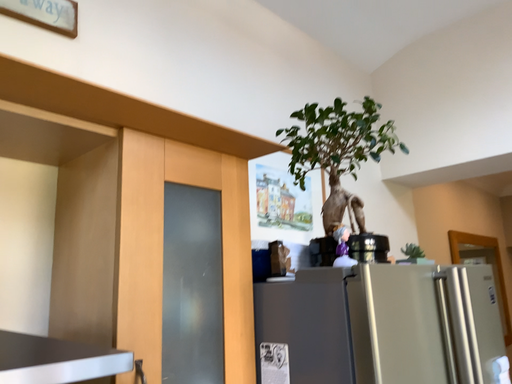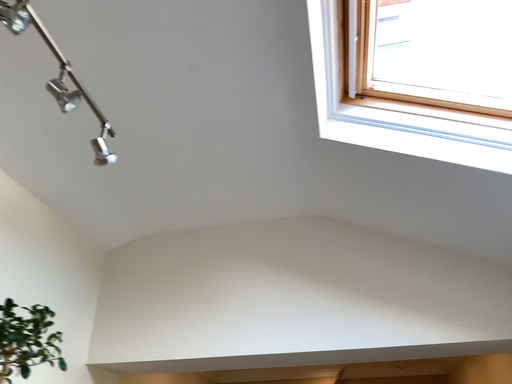
Question: Which way did the camera rotate in the video?

Choices:
 (A) rotated right
 (B) rotated left

Answer: (A)